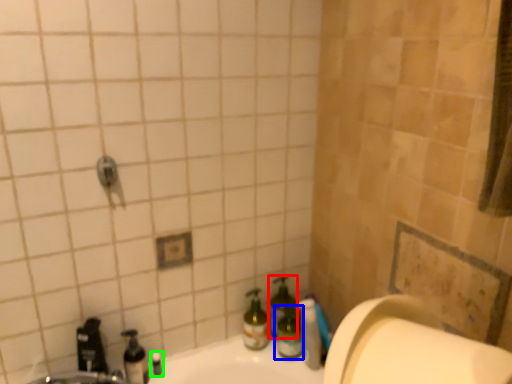
Question: Which object is the farthest from bottle (highlighted by a red box)? Choose among these: bottle (highlighted by a blue box) or toiletry (highlighted by a green box).

Choices:
 (A) bottle
 (B) toiletry

Answer: (B)